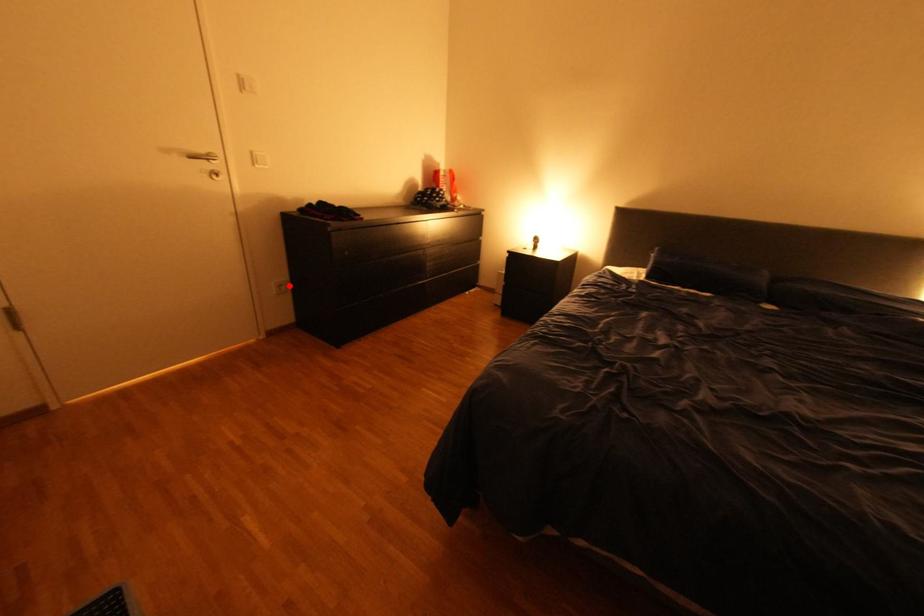
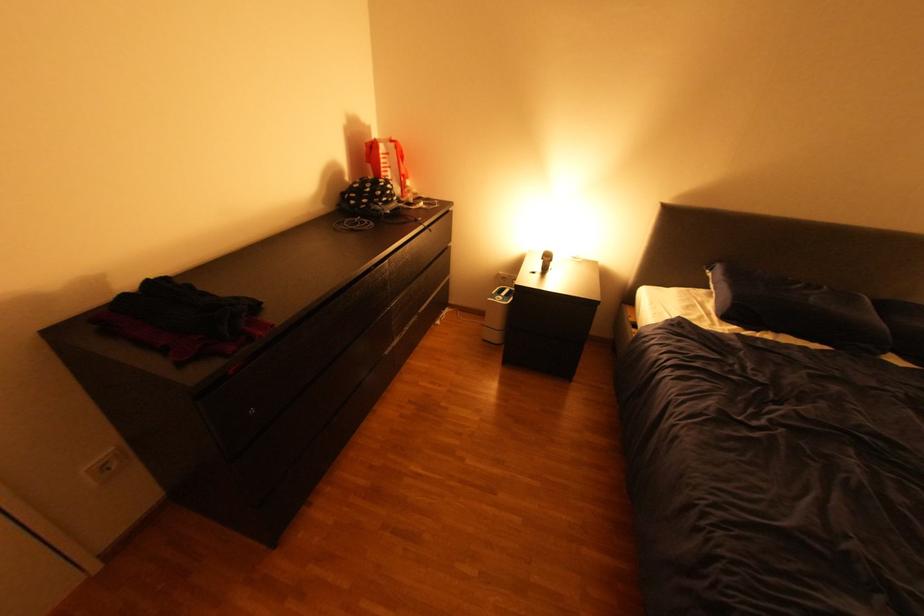
The point at the highlighted location is marked in the first image. Where is the corresponding point in the second image?

(114, 467)